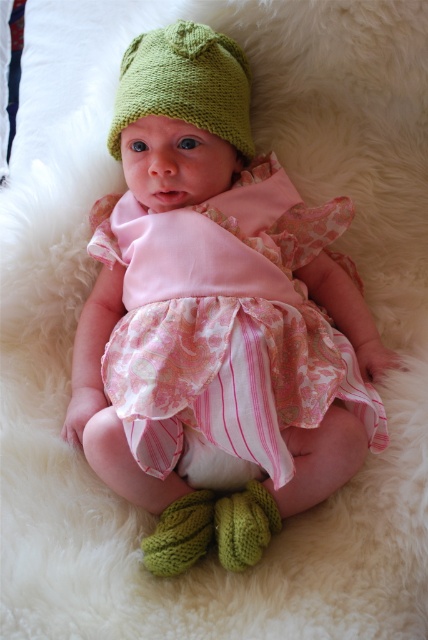
Question: Does pink floral fabric dress at center appear over green knitted hat at upper center?

Choices:
 (A) no
 (B) yes

Answer: (A)

Question: Does pink floral fabric dress at center have a smaller size compared to green knitted hat at upper center?

Choices:
 (A) yes
 (B) no

Answer: (B)

Question: Which point appears farthest from the camera in this image?

Choices:
 (A) (243, 150)
 (B) (205, 336)

Answer: (A)

Question: Which of the following is the farthest from the observer?

Choices:
 (A) pink floral fabric dress at center
 (B) green knitted hat at upper center

Answer: (B)

Question: Does pink floral fabric dress at center appear under green knitted hat at upper center?

Choices:
 (A) yes
 (B) no

Answer: (A)